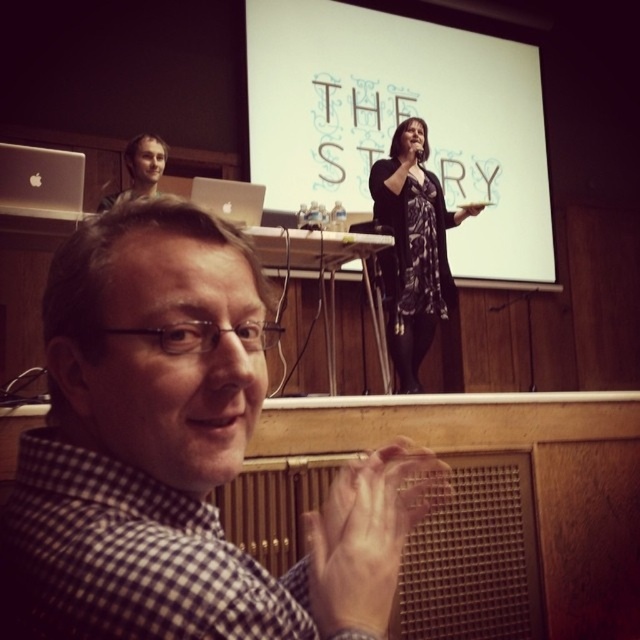
Which is in front, point (442, 273) or point (150, 186)?

Point (150, 186)

The height and width of the screenshot is (640, 640). Identify the location of black floral dress at center. (413, 248).

The height and width of the screenshot is (640, 640). I want to click on black floral dress at center, so tap(413, 248).

Which of these two, white checkered shirt at center or matte black hair at upper left, stands shorter?

Standing shorter between the two is matte black hair at upper left.

The image size is (640, 640). I want to click on white checkered shirt at center, so [x=179, y=452].

Is point (552, 257) closer to camera compared to point (45, 208)?

No, it is behind (45, 208).

Is white matte projection screen at upper center thinner than matte silver laptop at upper left?

Incorrect, white matte projection screen at upper center's width is not less than matte silver laptop at upper left's.

Is point (436, 154) closer to viewer compared to point (17, 176)?

No, it is behind (17, 176).

Where is `white matte projection screen at upper center`? Image resolution: width=640 pixels, height=640 pixels. white matte projection screen at upper center is located at coordinates (400, 122).